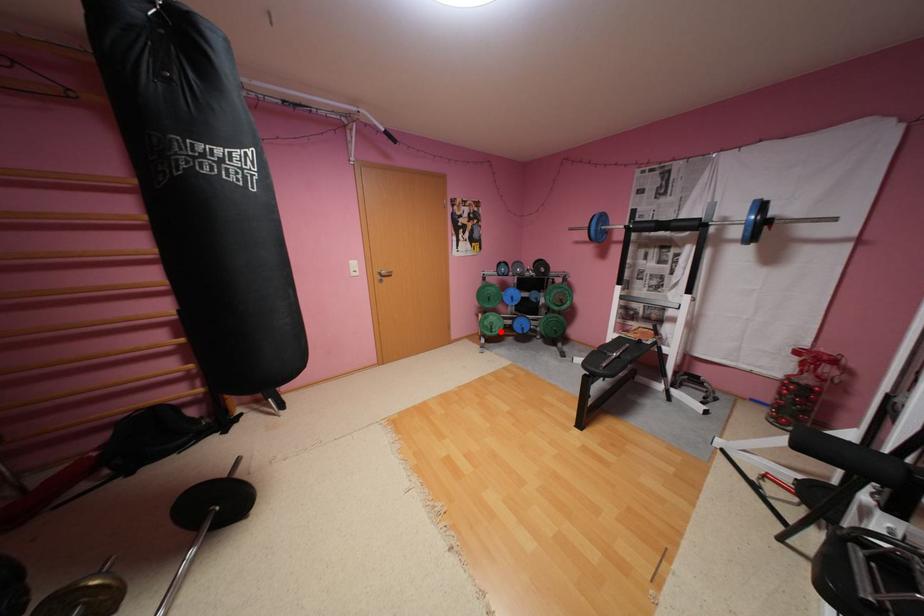
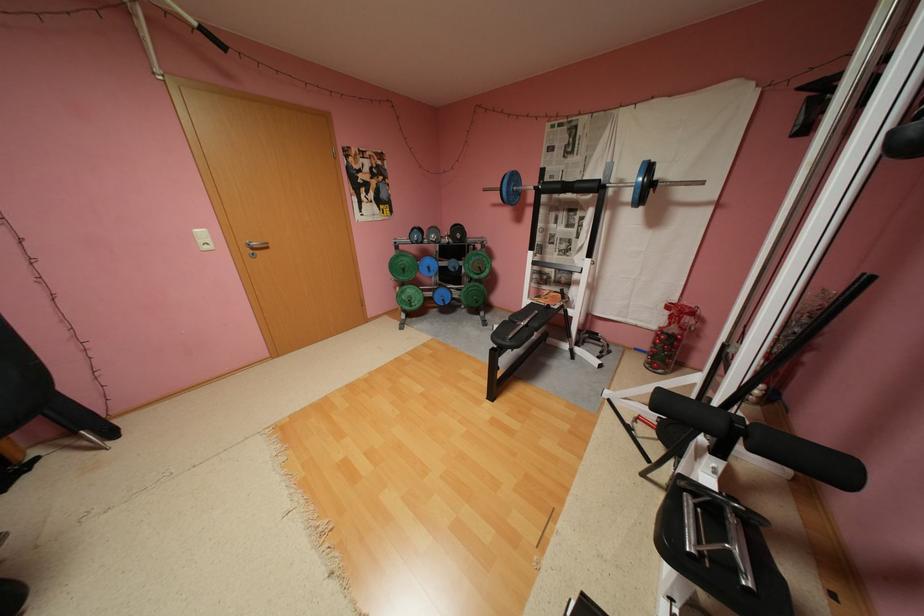
Question: I am providing you with two images of the same scene from different viewpoints. Image1 has a red point marked. In image2, the corresponding 3D location appears at what relative position? Reply with the corresponding letter.

Choices:
 (A) Closer
 (B) Farther

Answer: (A)